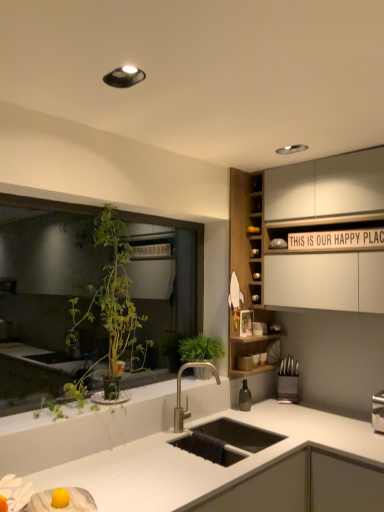
At what (x,y) coordinates should I click in order to perform the action: click on free space on the front side of satin nickel faucet at center. Please return your answer as a coordinate pair (x, y). Looking at the image, I should click on (202, 453).